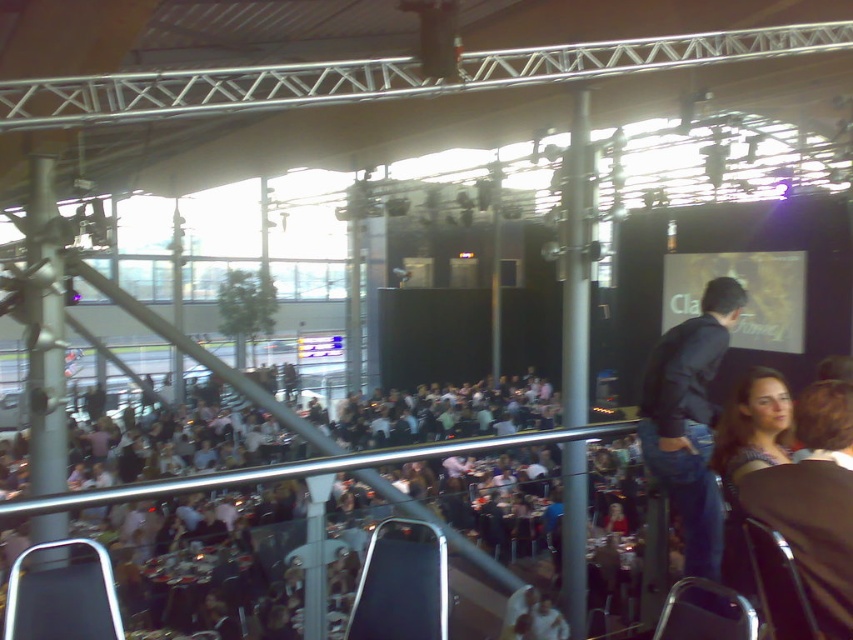
You are a guest at the event and want to find the blue denim shirt at lower right from the white fabric crowd at center. Which direction should you look?

You should look upwards because the white fabric crowd at center is below the blue denim shirt at lower right, meaning the blue denim shirt at lower right is above.

You are standing at the balcony and see the white fabric crowd at center and the dark blue jeans at center. Which one is positioned to the left?

The white fabric crowd at center is positioned to the left of dark blue jeans at center.

You are planning to set up a photo booth in this event space. You need to choose between two locations near the white fabric crowd at center and dark blue jeans at center. Which location would allow for a larger setup area?

The white fabric crowd at center is larger in size than dark blue jeans at center, so the location near the white fabric crowd at center would allow for a larger setup area.